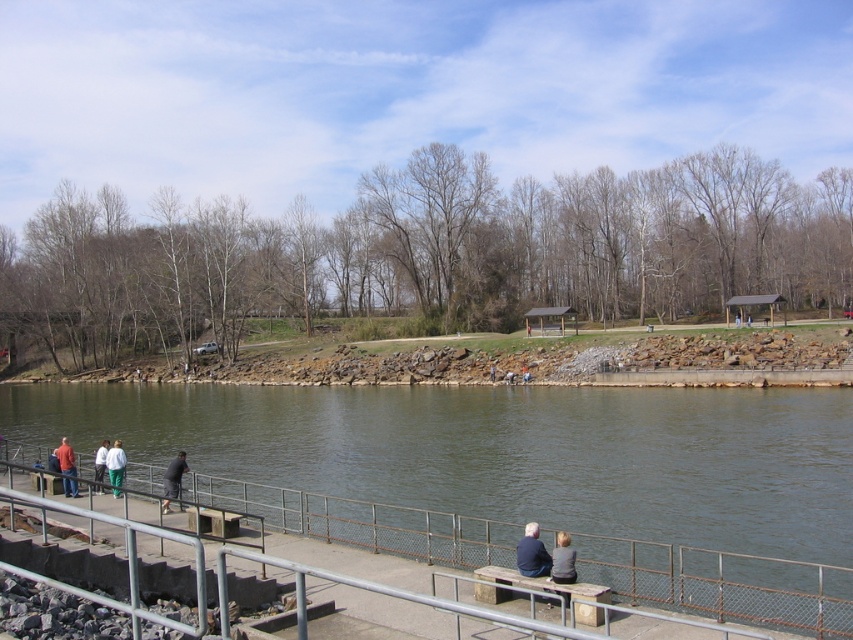
Between blue denim jacket at lower center and dark gray fabric jacket at lower center, which one has less height?

Answer: Standing shorter between the two is blue denim jacket at lower center.

Is point (540, 576) positioned after point (570, 560)?

Yes, point (540, 576) is behind point (570, 560).

The width and height of the screenshot is (853, 640). Find the location of `blue denim jacket at lower center`. blue denim jacket at lower center is located at coordinates (538, 557).

At what (x,y) coordinates should I click in order to perform the action: click on blue denim jacket at lower center. Please return your answer as a coordinate pair (x, y). Image resolution: width=853 pixels, height=640 pixels. Looking at the image, I should click on (538, 557).

Is dark gray fabric jacket at lower center shorter than matte red shirt at left?

Yes, dark gray fabric jacket at lower center is shorter than matte red shirt at left.

Identify the location of dark gray fabric jacket at lower center. This screenshot has height=640, width=853. (563, 561).

Can you confirm if dark blue jacket at lower right is taller than dark gray pants at lower left?

Incorrect, dark blue jacket at lower right's height is not larger of dark gray pants at lower left's.

Between dark blue jacket at lower right and dark gray pants at lower left, which one has more height?

dark gray pants at lower left

Is point (537, 529) closer to viewer compared to point (180, 480)?

Yes.

I want to click on dark blue jacket at lower right, so click(x=532, y=554).